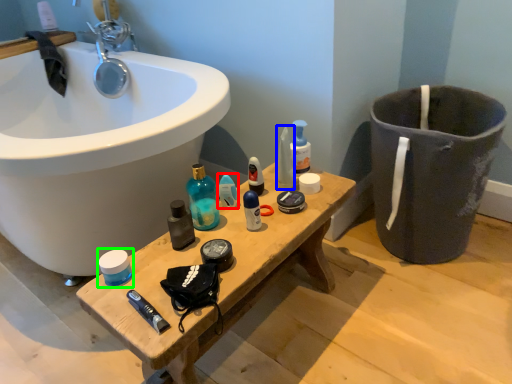
Question: Which object is positioned farthest from toiletry (highlighted by a red box)? Select from toiletry (highlighted by a blue box) and mouthwash (highlighted by a green box).

Choices:
 (A) toiletry
 (B) mouthwash

Answer: (B)